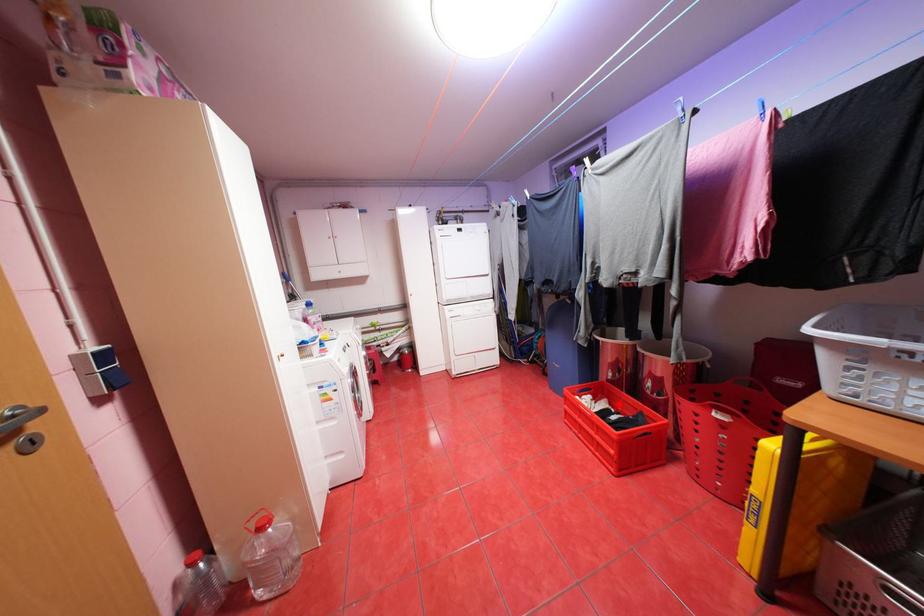
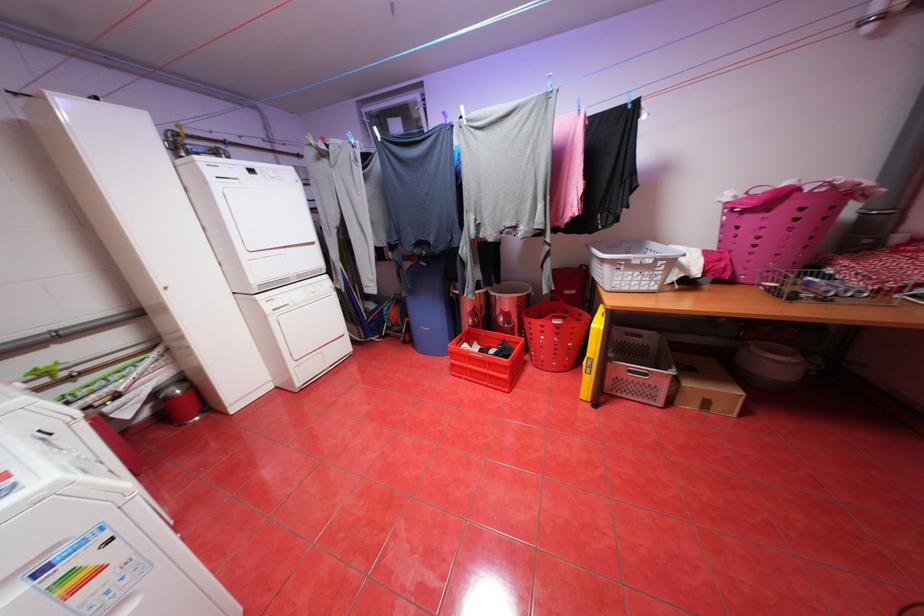
Question: A red point is marked in image1. In image2, is the corresponding 3D point closer to the camera or farther? Reply with the corresponding letter.

Choices:
 (A) The corresponding 3D point is closer.
 (B) The corresponding 3D point is farther.

Answer: (A)